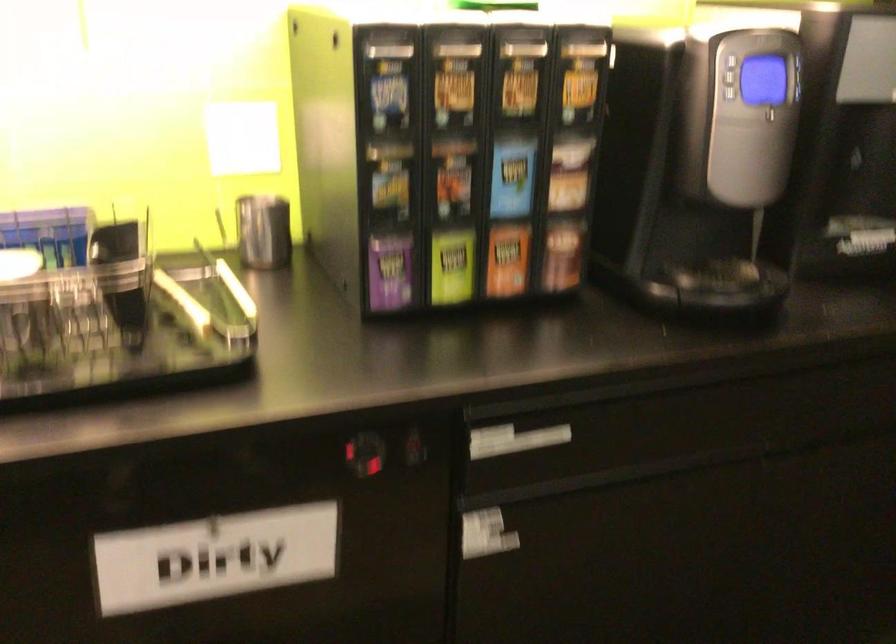
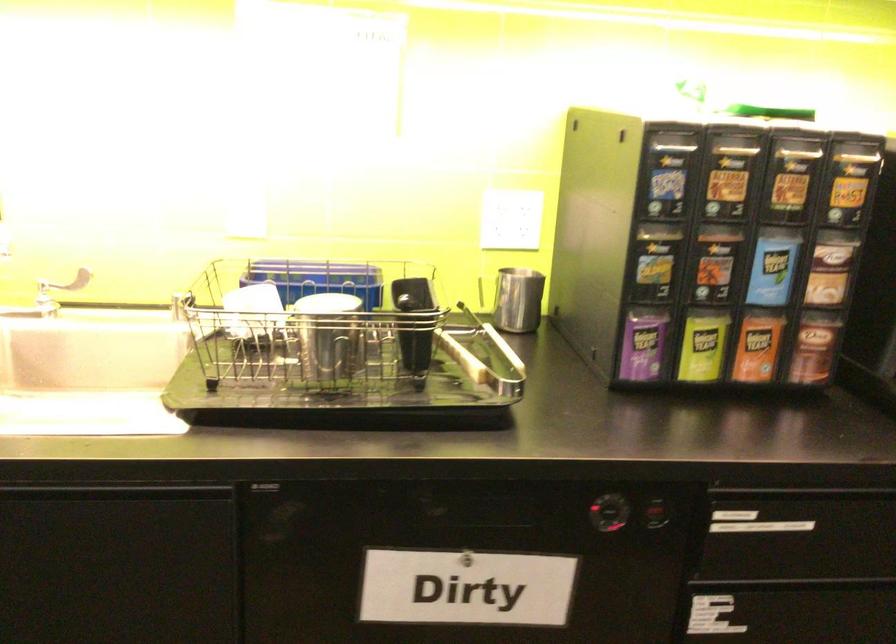
Question: The camera is either moving clockwise (left) or counter-clockwise (right) around the object. The first image is from the beginning of the video and the second image is from the end. Is the camera moving left or right when shooting the video?

Choices:
 (A) Left
 (B) Right

Answer: (B)